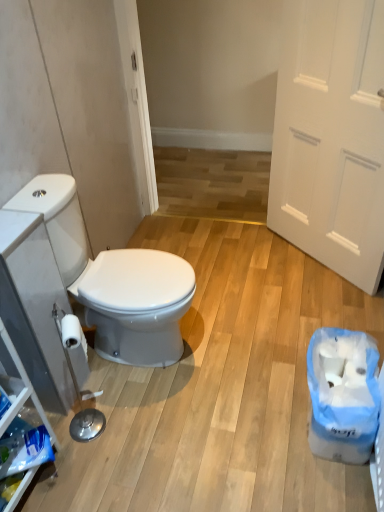
Question: Does blue plastic bag at lower right have a smaller size compared to white matte door at right?

Choices:
 (A) no
 (B) yes

Answer: (B)

Question: Would you consider blue plastic bag at lower right to be distant from white matte door at right?

Choices:
 (A) yes
 (B) no

Answer: (B)

Question: Is blue plastic bag at lower right closer to the viewer compared to white matte door at right?

Choices:
 (A) yes
 (B) no

Answer: (A)

Question: From a real-world perspective, is blue plastic bag at lower right under white matte door at right?

Choices:
 (A) no
 (B) yes

Answer: (B)

Question: Does blue plastic bag at lower right have a larger size compared to white matte door at right?

Choices:
 (A) no
 (B) yes

Answer: (A)

Question: From the image's perspective, does blue plastic bag at lower right appear lower than white matte door at right?

Choices:
 (A) no
 (B) yes

Answer: (B)

Question: Does white glossy toilet seat at left appear on the left side of white matte door at right?

Choices:
 (A) no
 (B) yes

Answer: (B)

Question: Is white glossy toilet seat at left taller than white matte door at right?

Choices:
 (A) yes
 (B) no

Answer: (B)

Question: Is white glossy toilet seat at left facing towards white matte door at right?

Choices:
 (A) no
 (B) yes

Answer: (A)

Question: Can you confirm if white glossy toilet seat at left is positioned to the right of white matte door at right?

Choices:
 (A) no
 (B) yes

Answer: (A)

Question: Is white glossy toilet seat at left oriented away from white matte door at right?

Choices:
 (A) yes
 (B) no

Answer: (B)

Question: From a real-world perspective, is white glossy toilet seat at left physically above white matte door at right?

Choices:
 (A) yes
 (B) no

Answer: (B)

Question: Considering the relative sizes of white matte door at right and white glossy toilet seat at left in the image provided, is white matte door at right shorter than white glossy toilet seat at left?

Choices:
 (A) yes
 (B) no

Answer: (B)